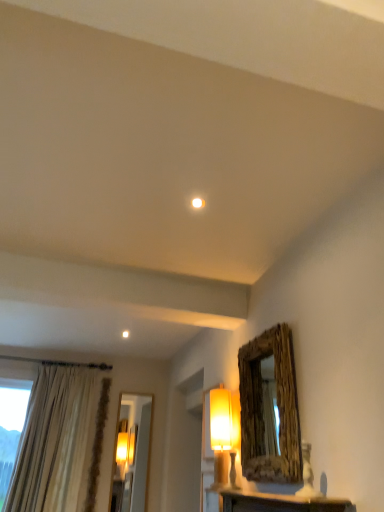
Locate an element on the screen. wooden frame mirror at upper right is located at coordinates (263, 409).

Does point (275, 501) come in front of point (42, 390)?

Yes, it is.

Is white marble table at lower center to the left of beige textured curtain at left from the viewer's perspective?

In fact, white marble table at lower center is to the right of beige textured curtain at left.

From the image's perspective, is white marble table at lower center located beneath beige textured curtain at left?

No, from the image's perspective, white marble table at lower center is not beneath beige textured curtain at left.

Between white marble table at lower center and beige textured curtain at left, which one has larger size?

beige textured curtain at left is bigger.

Considering the sizes of wooden frame mirror at upper right and beige textured curtain at left in the image, is wooden frame mirror at upper right wider or thinner than beige textured curtain at left?

Considering their sizes, wooden frame mirror at upper right looks slimmer than beige textured curtain at left.

Could you tell me if wooden frame mirror at upper right is facing beige textured curtain at left?

No, wooden frame mirror at upper right is not aimed at beige textured curtain at left.

Is wooden frame mirror at upper right positioned far away from beige textured curtain at left?

Yes, wooden frame mirror at upper right and beige textured curtain at left are located far from each other.

From a real-world perspective, relative to matte yellow fabric lampshade at center-right, is beige textured curtain at left vertically above or below?

From a real-world perspective, beige textured curtain at left is physically above matte yellow fabric lampshade at center-right.

You are a GUI agent. You are given a task and a screenshot of the screen. Output one action in this format:
    pyautogui.click(x=<x>, y=<y>)
    Task: Click on the curtain behind the matte yellow fabric lampshade at center-right
    
    Given the screenshot: What is the action you would take?
    pyautogui.click(x=60, y=442)

Can we say beige textured curtain at left lies outside matte yellow fabric lampshade at center-right?

Yes, beige textured curtain at left is located beyond the bounds of matte yellow fabric lampshade at center-right.

Would you say white glossy light bulb at center is inside or outside white marble table at lower center?

white glossy light bulb at center is not inside white marble table at lower center, it's outside.

In the scene shown: Is white glossy light bulb at center positioned in front of white marble table at lower center?

No, the depth of white glossy light bulb at center is greater than that of white marble table at lower center.

From the image's perspective, is white glossy light bulb at center located above white marble table at lower center?

Yes, from the image's perspective, white glossy light bulb at center is above white marble table at lower center.

Consider the image. Would you say white glossy light bulb at center is to the left or to the right of white marble table at lower center in the picture?

Based on their positions, white glossy light bulb at center is located to the left of white marble table at lower center.

From the picture: From the image's perspective, is matte yellow fabric lampshade at center-right on top of wooden frame mirror at upper right?

No, from the image's perspective, matte yellow fabric lampshade at center-right is not on top of wooden frame mirror at upper right.

Considering the positions of points (214, 440) and (258, 372), is point (214, 440) farther from camera compared to point (258, 372)?

Yes, point (214, 440) is farther from viewer.

At what (x,y) coordinates should I click in order to perform the action: click on mirror that is above the matte yellow fabric lampshade at center-right (from the image's perspective). Please return your answer as a coordinate pair (x, y). Looking at the image, I should click on coord(263,409).

Is matte yellow fabric lampshade at center-right surrounding wooden frame mirror at upper right?

No, wooden frame mirror at upper right is not inside matte yellow fabric lampshade at center-right.

In the scene shown: From the image's perspective, which one is positioned lower, wooden frame mirror at upper right or white marble table at lower center?

white marble table at lower center appears lower in the image.

From a real-world perspective, is wooden frame mirror at upper right above or below white marble table at lower center?

Clearly, from a real-world perspective, wooden frame mirror at upper right is above white marble table at lower center.

Identify the location of curtain on the left of the wooden frame mirror at upper right. (60, 442).

Is beige textured curtain at left positioned with its back to wooden frame mirror at upper right?

No, beige textured curtain at left is not facing the opposite direction of wooden frame mirror at upper right.

Is point (10, 497) behind point (274, 474)?

That is True.

Do you think beige textured curtain at left is within wooden frame mirror at upper right, or outside of it?

beige textured curtain at left exists outside the volume of wooden frame mirror at upper right.

The width and height of the screenshot is (384, 512). Identify the location of table beneath the beige textured curtain at left (from a real-world perspective). (279, 502).

I want to click on curtain that appears on the left of wooden frame mirror at upper right, so click(60, 442).

Looking at the image, which one is located further to white marble table at lower center, beige textured curtain at left or wooden frame mirror at upper right?

beige textured curtain at left.

Estimate the real-world distances between objects in this image. Which object is closer to matte yellow fabric lampshade at center-right, beige textured curtain at left or white glossy light bulb at center?

Based on the image, white glossy light bulb at center appears to be nearer to matte yellow fabric lampshade at center-right.

Which object lies further to the anchor point white marble table at lower center, wooden frame mirror at upper right or matte yellow fabric lampshade at center-right?

wooden frame mirror at upper right lies further to white marble table at lower center than the other object.

Estimate the real-world distances between objects in this image. Which object is closer to white glossy light bulb at center, beige textured curtain at left or wooden frame mirror at upper right?

wooden frame mirror at upper right is positioned closer to the anchor white glossy light bulb at center.

When comparing their distances from wooden frame mirror at upper right, does white glossy light bulb at center or beige textured curtain at left seem further?

The object further to wooden frame mirror at upper right is beige textured curtain at left.

Which object lies nearer to the anchor point wooden frame mirror at upper right, beige textured curtain at left or white glossy light bulb at center?

white glossy light bulb at center.

Based on their spatial positions, is white marble table at lower center or beige textured curtain at left closer to wooden frame mirror at upper right?

white marble table at lower center.

Considering their positions, is white glossy light bulb at center positioned closer to wooden frame mirror at upper right than white marble table at lower center?

white marble table at lower center.

Find the location of a particular element. The image size is (384, 512). table lamp between white glossy light bulb at center and beige textured curtain at left vertically is located at coordinates (224, 432).

You are a GUI agent. You are given a task and a screenshot of the screen. Output one action in this format:
    pyautogui.click(x=<x>, y=<y>)
    Task: Click on the lighting between white marble table at lower center and beige textured curtain at left along the z-axis
    The width and height of the screenshot is (384, 512).
    Given the screenshot: What is the action you would take?
    pyautogui.click(x=198, y=203)

Find the location of a particular element. table lamp situated between beige textured curtain at left and wooden frame mirror at upper right from left to right is located at coordinates (224, 432).

Identify the location of mirror between white glossy light bulb at center and white marble table at lower center vertically. (263, 409).